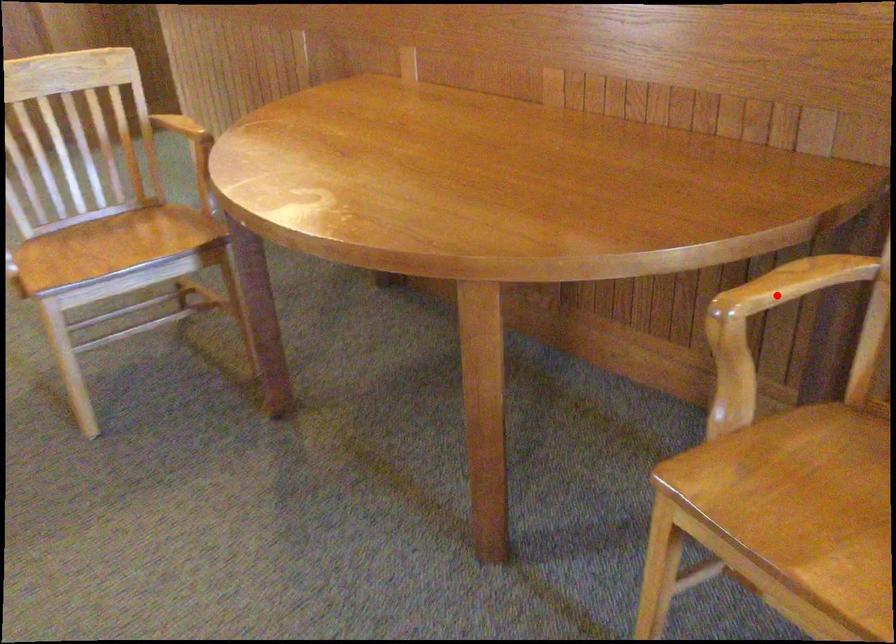
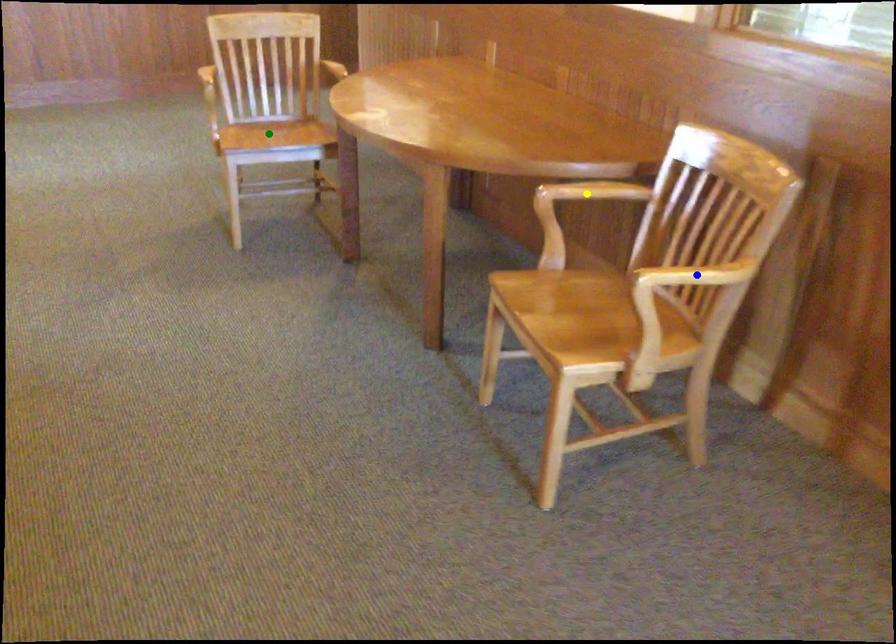
Question: I am providing you with two images of the same scene from different viewpoints. A red point is marked on the first image. You are given multiple points on the second image. Which point in image 2 represents the same 3d spot as the red point in image 1?

Choices:
 (A) green point
 (B) yellow point
 (C) blue point

Answer: (B)